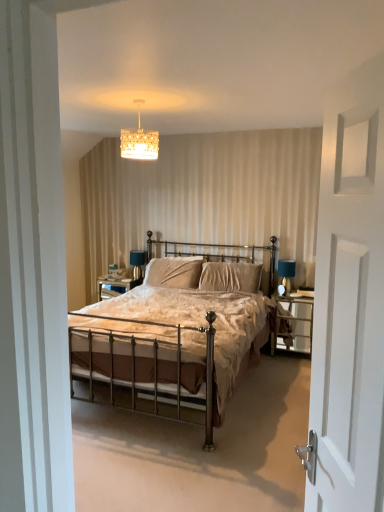
What do you see at coordinates (230, 277) in the screenshot? I see `velvet beige pillow at center, placed as the 2th pillow when sorted from left to right` at bounding box center [230, 277].

What do you see at coordinates (294, 322) in the screenshot?
I see `metallic silver nightstand at right` at bounding box center [294, 322].

In order to face metallic silver nightstand at right, should I rotate leftwards or rightwards?

It's best to rotate right around 13.729 degrees.

Locate an element on the screen. bronze metal bed at center is located at coordinates (171, 345).

Describe the element at coordinates (139, 140) in the screenshot. The image size is (384, 512). I see `gold textured chandelier at upper center` at that location.

The height and width of the screenshot is (512, 384). Describe the element at coordinates (174, 272) in the screenshot. I see `velvet beige pillow at center, the 2th pillow in the right-to-left sequence` at that location.

Where is `white matte screen door at right`? white matte screen door at right is located at coordinates (348, 377).

From the picture: Considering the positions of objects metallic silver nightstand at right and velvet beige pillow at center, marked as the 1th pillow in a left-to-right arrangement, in the image provided, who is behind, metallic silver nightstand at right or velvet beige pillow at center, marked as the 1th pillow in a left-to-right arrangement,?

velvet beige pillow at center, marked as the 1th pillow in a left-to-right arrangement.

From a real-world perspective, relative to velvet beige pillow at center, marked as the 1th pillow in a left-to-right arrangement, is metallic silver nightstand at right vertically above or below?

metallic silver nightstand at right is situated lower than velvet beige pillow at center, marked as the 1th pillow in a left-to-right arrangement, in the real world.

Considering the positions of objects metallic silver nightstand at right and velvet beige pillow at center, marked as the 1th pillow in a left-to-right arrangement, in the image provided, who is more to the right, metallic silver nightstand at right or velvet beige pillow at center, marked as the 1th pillow in a left-to-right arrangement,?

Positioned to the right is metallic silver nightstand at right.

The image size is (384, 512). In order to click on nightstand directly beneath the velvet beige pillow at center, the 2th pillow in the right-to-left sequence (from a real-world perspective) in this screenshot , I will do pyautogui.click(x=294, y=322).

Which of these two, matte black table lamp at right or metallic silver nightstand at right, is wider?

Wider between the two is metallic silver nightstand at right.

This screenshot has width=384, height=512. In the image, there is a metallic silver nightstand at right. Find the location of `table lamp above it (from the image's perspective)`. table lamp above it (from the image's perspective) is located at coordinates (286, 274).

Considering the positions of objects matte black table lamp at right and metallic silver nightstand at right in the image provided, who is behind, matte black table lamp at right or metallic silver nightstand at right?

matte black table lamp at right is more distant.

In the scene shown: Visually, is bronze metal bed at center positioned to the left or to the right of white matte screen door at right?

bronze metal bed at center is to the left of white matte screen door at right.

From a real-world perspective, who is located lower, bronze metal bed at center or white matte screen door at right?

bronze metal bed at center.

Considering the points (193, 379) and (362, 251), which point is in front, point (193, 379) or point (362, 251)?

Positioned in front is point (362, 251).

Is point (151, 282) positioned after point (202, 327)?

Yes.

From the image's perspective, who appears lower, velvet beige pillow at center, marked as the 1th pillow in a left-to-right arrangement, or bronze metal bed at center?

bronze metal bed at center.

Is velvet beige pillow at center, the 2th pillow in the right-to-left sequence, placed right next to bronze metal bed at center?

There is a gap between velvet beige pillow at center, the 2th pillow in the right-to-left sequence, and bronze metal bed at center.

From a real-world perspective, between velvet beige pillow at center, placed as the 2th pillow when sorted from left to right, and gold textured chandelier at upper center, who is vertically lower?

From a 3D spatial view, velvet beige pillow at center, placed as the 2th pillow when sorted from left to right, is below.

Looking at their sizes, would you say velvet beige pillow at center, arranged as the 1th pillow when viewed from the right, is wider or thinner than gold textured chandelier at upper center?

Considering their sizes, velvet beige pillow at center, arranged as the 1th pillow when viewed from the right, looks slimmer than gold textured chandelier at upper center.

Is velvet beige pillow at center, placed as the 2th pillow when sorted from left to right, shorter than gold textured chandelier at upper center?

Incorrect, the height of velvet beige pillow at center, placed as the 2th pillow when sorted from left to right, does not fall short of that of gold textured chandelier at upper center.

Is point (249, 264) closer or farther from the camera than point (135, 139)?

Point (249, 264) appears to be farther away from the viewer than point (135, 139).

Is white matte screen door at right taller than velvet beige pillow at center, placed as the 2th pillow when sorted from left to right?

Correct, white matte screen door at right is much taller as velvet beige pillow at center, placed as the 2th pillow when sorted from left to right.

Does white matte screen door at right have a greater width compared to velvet beige pillow at center, placed as the 2th pillow when sorted from left to right?

No, white matte screen door at right is not wider than velvet beige pillow at center, placed as the 2th pillow when sorted from left to right.

From a real-world perspective, which object stands above the other?

white matte screen door at right is physically above.

Locate an element on the screen. pillow that is the 2nd object located above the white matte screen door at right (from the image's perspective) is located at coordinates (174, 272).

Considering the positions of objects velvet beige pillow at center, the 2th pillow in the right-to-left sequence, and white matte screen door at right in the image provided, who is more to the left, velvet beige pillow at center, the 2th pillow in the right-to-left sequence, or white matte screen door at right?

velvet beige pillow at center, the 2th pillow in the right-to-left sequence.

Which is nearer, (187, 265) or (332, 362)?

The point (332, 362) is closer to the camera.

From a real-world perspective, is velvet beige pillow at center, the 2th pillow in the right-to-left sequence, physically located above or below white matte screen door at right?

velvet beige pillow at center, the 2th pillow in the right-to-left sequence, is situated lower than white matte screen door at right in the real world.

In the image, there is a velvet beige pillow at center, marked as the 1th pillow in a left-to-right arrangement. Identify the location of nightstand below it (from the image's perspective). (x=294, y=322).

In the image, there is a matte black table lamp at right. At what (x,y) coordinates should I click in order to perform the action: click on nightstand below it (from a real-world perspective). Please return your answer as a coordinate pair (x, y). Looking at the image, I should click on (294, 322).

Estimate the real-world distances between objects in this image. Which object is further from matte black table lamp at right, velvet beige pillow at center, marked as the 1th pillow in a left-to-right arrangement, or gold textured chandelier at upper center?

The object further to matte black table lamp at right is gold textured chandelier at upper center.

Looking at this image, based on their spatial positions, is bronze metal bed at center or matte black table lamp at right further from velvet beige pillow at center, placed as the 2th pillow when sorted from left to right?

bronze metal bed at center.

Considering their positions, is white matte screen door at right positioned further to bronze metal bed at center than gold textured chandelier at upper center?

white matte screen door at right.

When comparing their distances from bronze metal bed at center, does white matte screen door at right or velvet beige pillow at center, arranged as the 1th pillow when viewed from the right, seem closer?

velvet beige pillow at center, arranged as the 1th pillow when viewed from the right, is positioned closer to the anchor bronze metal bed at center.

Which object lies further to the anchor point velvet beige pillow at center, the 2th pillow in the right-to-left sequence, metallic silver nightstand at right or velvet beige pillow at center, arranged as the 1th pillow when viewed from the right?

metallic silver nightstand at right lies further to velvet beige pillow at center, the 2th pillow in the right-to-left sequence, than the other object.

Estimate the real-world distances between objects in this image. Which object is closer to velvet beige pillow at center, the 2th pillow in the right-to-left sequence, matte black table lamp at right or gold textured chandelier at upper center?

Among the two, matte black table lamp at right is located nearer to velvet beige pillow at center, the 2th pillow in the right-to-left sequence.

From the image, which object appears to be nearer to metallic silver nightstand at right, velvet beige pillow at center, marked as the 1th pillow in a left-to-right arrangement, or bronze metal bed at center?

The object closer to metallic silver nightstand at right is bronze metal bed at center.

Considering their positions, is metallic silver nightstand at right positioned further to bronze metal bed at center than matte black table lamp at right?

matte black table lamp at right.

Find the location of a particular element. This screenshot has width=384, height=512. nightstand located between white matte screen door at right and matte black table lamp at right in the depth direction is located at coordinates (294, 322).

Locate an element on the screen. The height and width of the screenshot is (512, 384). light fixture positioned between bronze metal bed at center and velvet beige pillow at center, marked as the 1th pillow in a left-to-right arrangement, from near to far is located at coordinates (139, 140).

What are the coordinates of `table lamp between velvet beige pillow at center, placed as the 2th pillow when sorted from left to right, and metallic silver nightstand at right` in the screenshot? It's located at (286, 274).

The width and height of the screenshot is (384, 512). What are the coordinates of `table lamp located between bronze metal bed at center and velvet beige pillow at center, placed as the 2th pillow when sorted from left to right, in the depth direction` in the screenshot? It's located at (286, 274).